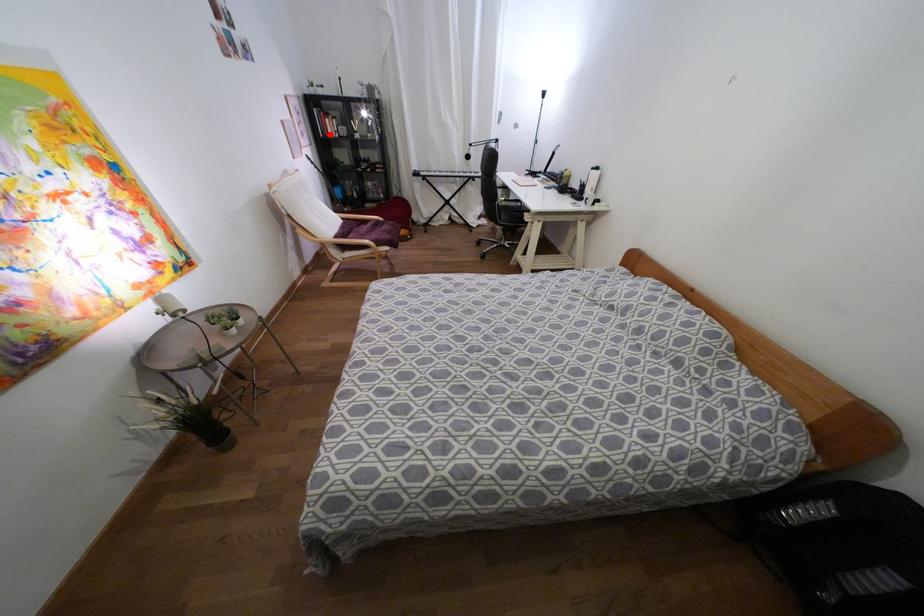
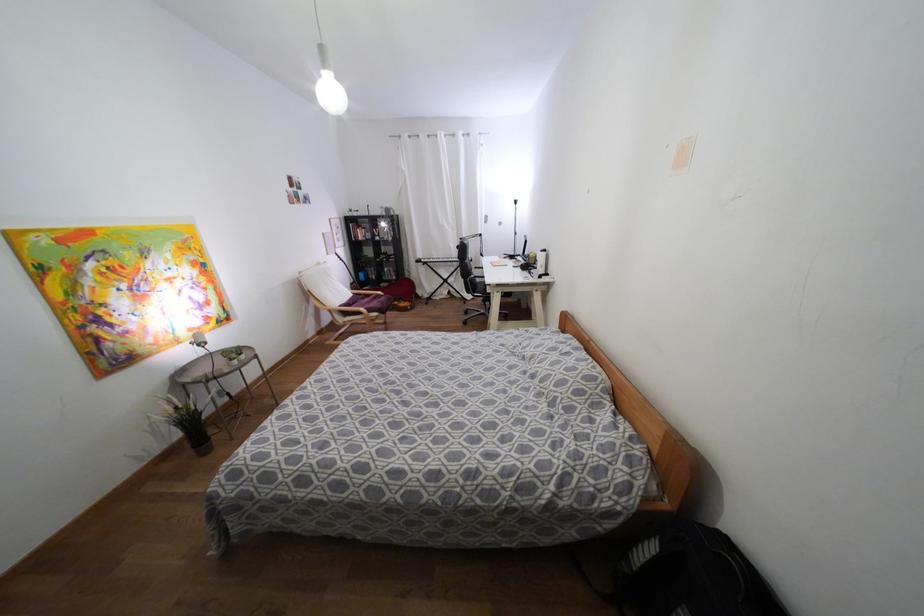
In the second image, find the point that corresponds to the highlighted location in the first image.

(359, 238)